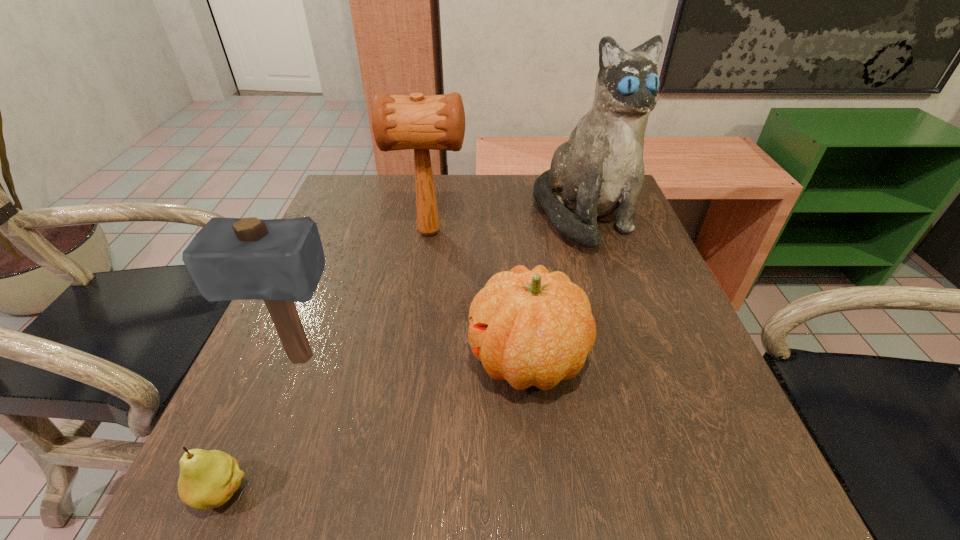
Locate an element on the screen. The width and height of the screenshot is (960, 540). object present at the near left corner is located at coordinates (208, 479).

This screenshot has height=540, width=960. Identify the location of object at the far right corner. (599, 170).

Locate an element on the screen. The image size is (960, 540). vacant space at the far edge is located at coordinates (410, 214).

In the image, there is a desktop. Identify the location of vacant space at the near edge. This screenshot has width=960, height=540. (596, 491).

Where is `blank area at the left edge`? blank area at the left edge is located at coordinates (349, 312).

What are the coordinates of `vacant space at the right edge of the desktop` in the screenshot? It's located at (628, 298).

In the image, there is a desktop. Identify the location of vacant space at the far left corner. pyautogui.click(x=385, y=185).

The width and height of the screenshot is (960, 540). In the image, there is a desktop. Identify the location of free space at the near right corner. (666, 516).

I want to click on blank region between the cat and the left mallet, so [x=442, y=287].

Where is `vacant region between the nearer mallet and the pumpkin`? vacant region between the nearer mallet and the pumpkin is located at coordinates (414, 359).